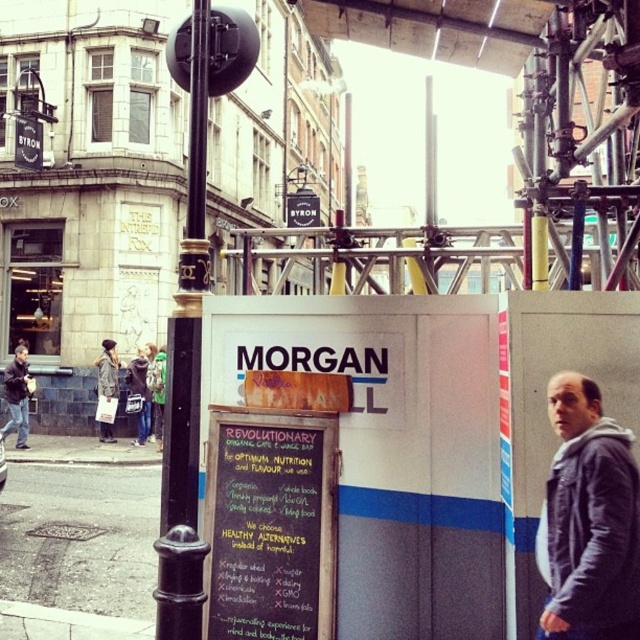
Question: From the image, what is the correct spatial relationship of dark gray jacket at left in relation to denim jacket at center?

Choices:
 (A) below
 (B) above

Answer: (B)

Question: Which object appears closest to the camera in this image?

Choices:
 (A) denim jacket at center
 (B) dark gray jacket at left

Answer: (B)

Question: Is dark gray hoodie at right wider than leather jacket at left?

Choices:
 (A) no
 (B) yes

Answer: (A)

Question: Among these points, which one is farthest from the camera?

Choices:
 (A) (180, 458)
 (B) (285, 625)
 (C) (564, 467)

Answer: (B)

Question: Which is farther from the denim jacket at center?

Choices:
 (A) dark gray jacket at left
 (B) black polished metal pole at left

Answer: (B)

Question: Observing the image, what is the correct spatial positioning of chalkboard sign at center in reference to dark gray jacket at left?

Choices:
 (A) below
 (B) above

Answer: (B)